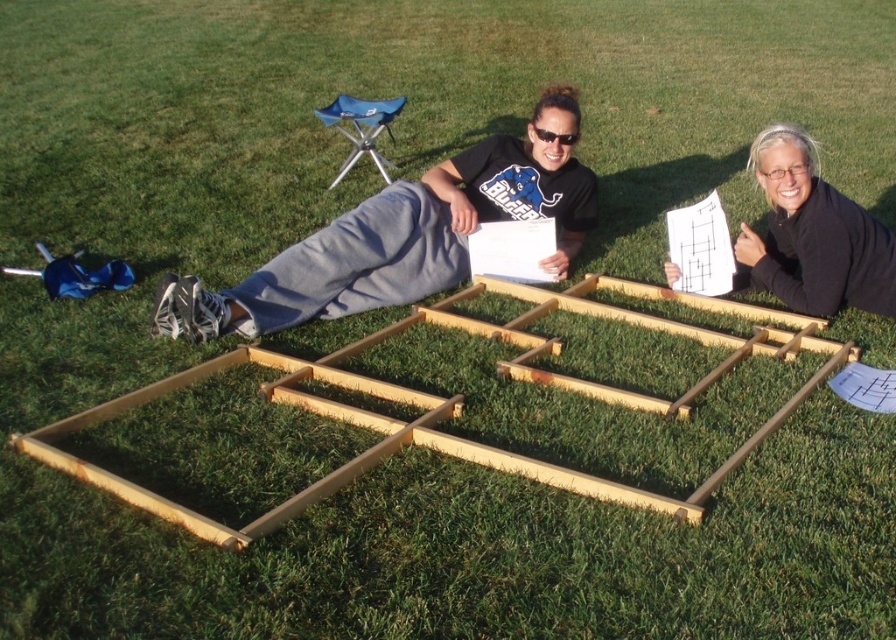
Question: Does gray fabric pants at center have a lesser width compared to black matte paper at upper right?

Choices:
 (A) yes
 (B) no

Answer: (B)

Question: Which object appears closest to the camera in this image?

Choices:
 (A) black matte paper at upper right
 (B) gray fabric pants at center

Answer: (B)

Question: Observing the image, what is the correct spatial positioning of gray fabric pants at center in reference to black matte paper at upper right?

Choices:
 (A) right
 (B) left

Answer: (B)

Question: Is gray fabric pants at center closer to camera compared to black matte paper at upper right?

Choices:
 (A) yes
 (B) no

Answer: (A)